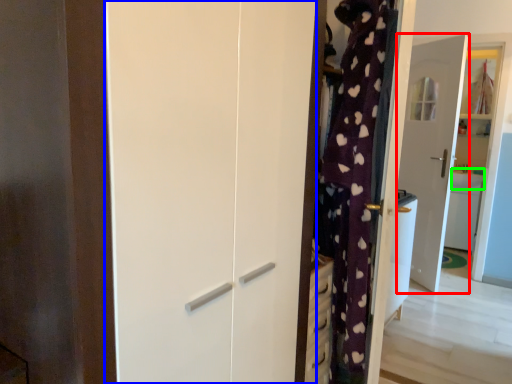
Question: Which object is positioned closest to door (highlighted by a red box)? Select from screen door (highlighted by a blue box) and counter top (highlighted by a green box).

Choices:
 (A) screen door
 (B) counter top

Answer: (B)